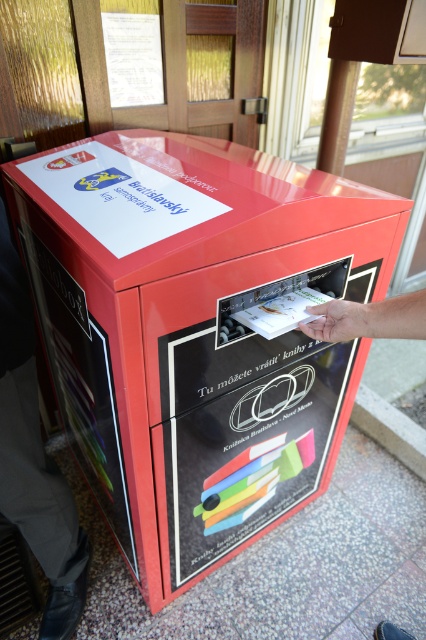
Based on the photo, which is more to the left, metallic red atm at center or gray fabric pants at lower left?

gray fabric pants at lower left

Who is lower down, metallic red atm at center or gray fabric pants at lower left?

gray fabric pants at lower left is lower down.

Is point (71, 368) in front of point (25, 282)?

No.

I want to click on metallic red atm at center, so click(x=193, y=330).

Which is above, gray fabric pants at lower left or skinny hand at center?

skinny hand at center is higher up.

Who is taller, gray fabric pants at lower left or skinny hand at center?

With more height is gray fabric pants at lower left.

Is point (45, 554) behind point (379, 333)?

Yes, point (45, 554) is farther from viewer.

You are a GUI agent. You are given a task and a screenshot of the screen. Output one action in this format:
    pyautogui.click(x=<x>, y=<y>)
    Task: Click on the gray fabric pants at lower left
    This screenshot has width=426, height=640.
    Given the screenshot: What is the action you would take?
    pyautogui.click(x=34, y=458)

Is metallic red atm at center thinner than skinny hand at center?

In fact, metallic red atm at center might be wider than skinny hand at center.

Can you confirm if metallic red atm at center is wider than skinny hand at center?

Indeed, metallic red atm at center has a greater width compared to skinny hand at center.

The image size is (426, 640). In order to click on metallic red atm at center in this screenshot , I will do `click(193, 330)`.